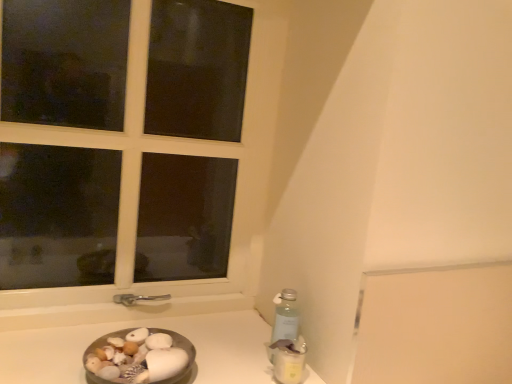
The height and width of the screenshot is (384, 512). I want to click on free location to the left of smooth white shells at lower left, so click(48, 360).